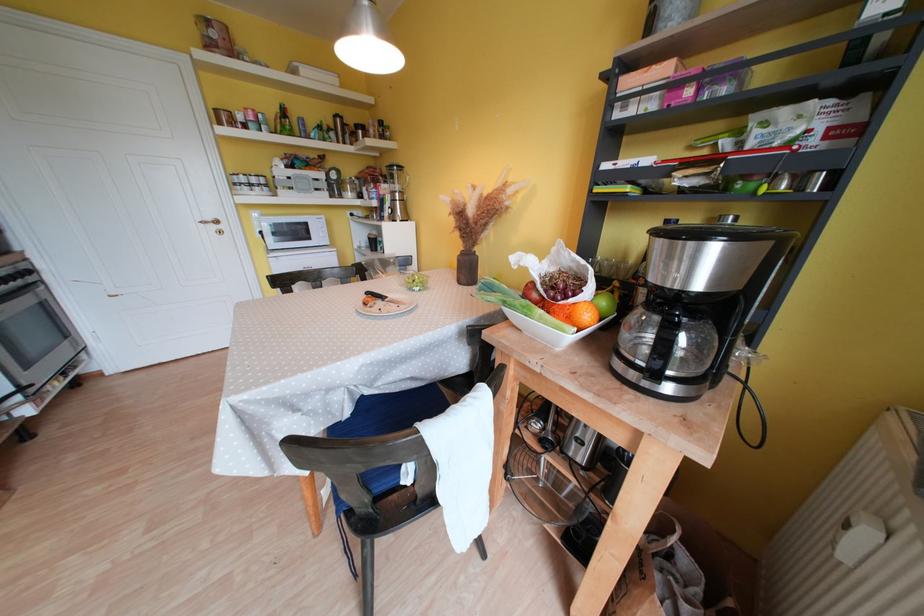
The height and width of the screenshot is (616, 924). I want to click on coffee maker lid, so click(711, 238).